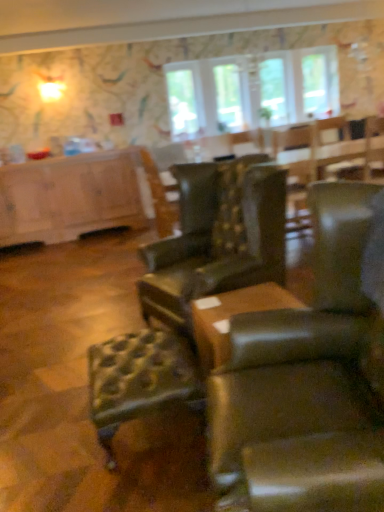
Question: From the image's perspective, is clear glass window at upper center, which appears as the first window when viewed from the right, beneath brown leather ottoman at center?

Choices:
 (A) no
 (B) yes

Answer: (A)

Question: Can you see clear glass window at upper center, which appears as the first window when viewed from the right, touching brown leather ottoman at center?

Choices:
 (A) yes
 (B) no

Answer: (B)

Question: Considering the relative sizes of clear glass window at upper center, which appears as the first window when viewed from the right, and brown leather ottoman at center in the image provided, is clear glass window at upper center, which appears as the first window when viewed from the right, thinner than brown leather ottoman at center?

Choices:
 (A) yes
 (B) no

Answer: (A)

Question: Could brown leather ottoman at center be considered to be inside clear glass window at upper center, which ranks as the 2th window in left-to-right order?

Choices:
 (A) yes
 (B) no

Answer: (B)

Question: Does clear glass window at upper center, which ranks as the 2th window in left-to-right order, appear on the right side of brown leather ottoman at center?

Choices:
 (A) no
 (B) yes

Answer: (B)

Question: Does point (107, 387) appear closer or farther from the camera than point (200, 128)?

Choices:
 (A) farther
 (B) closer

Answer: (B)

Question: Looking at the image, does leather tufted bar stool at center seem bigger or smaller compared to clear glass window at upper center, which appears as the first window screen when viewed from the left?

Choices:
 (A) small
 (B) big

Answer: (B)

Question: Looking at their shapes, would you say leather tufted bar stool at center is wider or thinner than clear glass window at upper center, which appears as the first window screen when viewed from the left?

Choices:
 (A) thin
 (B) wide

Answer: (B)

Question: Relative to clear glass window at upper center, which appears as the first window screen when viewed from the left, is leather tufted bar stool at center in front or behind?

Choices:
 (A) behind
 (B) front

Answer: (B)

Question: Based on their positions, is clear glass window at upper center, which appears as the first window screen when viewed from the left, located to the left or right of clear glass window at upper center, the second window screen viewed from the left?

Choices:
 (A) left
 (B) right

Answer: (A)

Question: In terms of height, does clear glass window at upper center, arranged as the 2th window screen when viewed from the right, look taller or shorter compared to clear glass window at upper center, the second window screen viewed from the left?

Choices:
 (A) short
 (B) tall

Answer: (B)

Question: Is clear glass window at upper center, which appears as the first window screen when viewed from the left, wider or thinner than clear glass window at upper center, which is the 1th window screen from right to left?

Choices:
 (A) wide
 (B) thin

Answer: (B)

Question: Looking at the image, does clear glass window at upper center, arranged as the 2th window screen when viewed from the right, seem bigger or smaller compared to clear glass window at upper center, the second window screen viewed from the left?

Choices:
 (A) small
 (B) big

Answer: (A)

Question: In the image, is clear glass window at upper center, the 1th window in the left-to-right sequence, positioned in front of or behind leather tufted bar stool at center?

Choices:
 (A) front
 (B) behind

Answer: (B)

Question: In terms of width, does clear glass window at upper center, the 1th window in the left-to-right sequence, look wider or thinner when compared to leather tufted bar stool at center?

Choices:
 (A) thin
 (B) wide

Answer: (A)